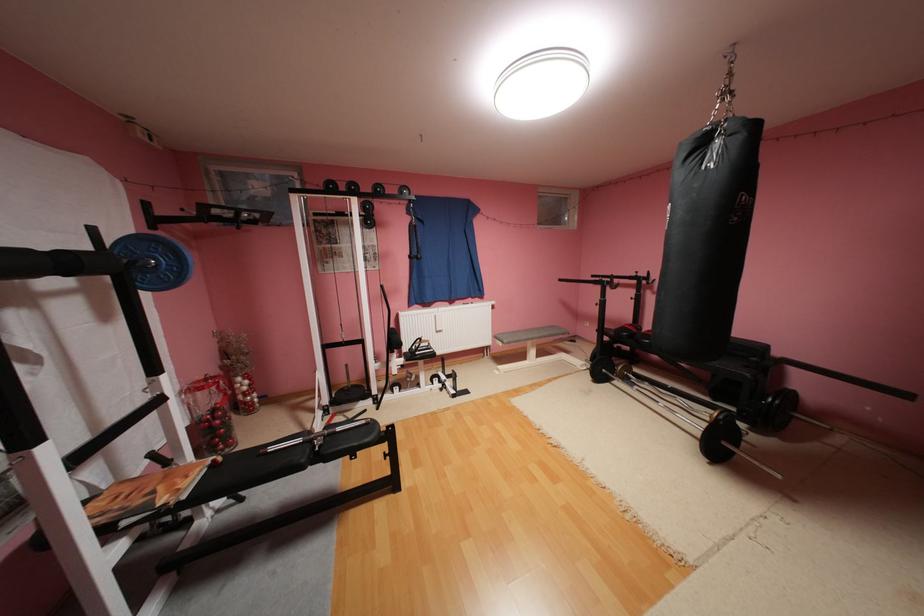
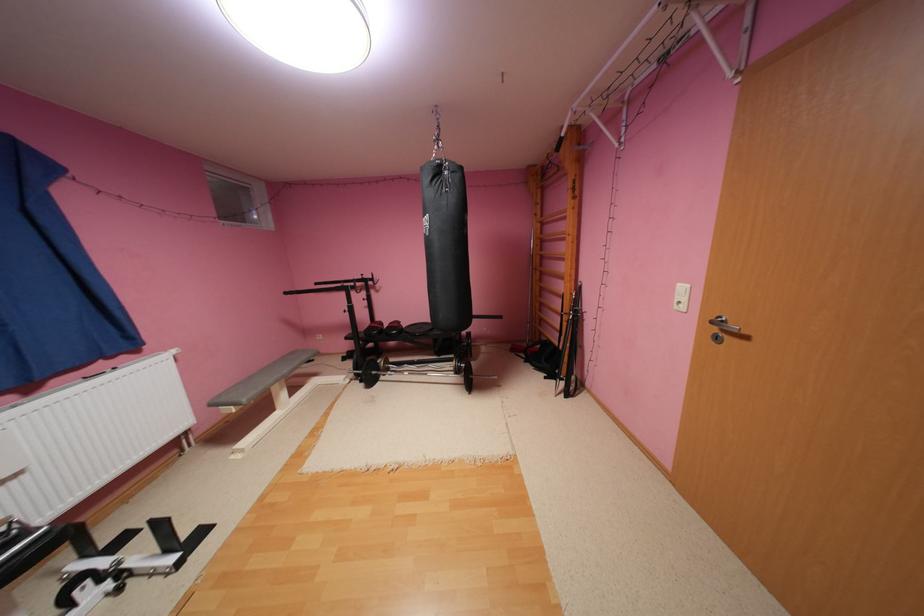
The point at (507,336) is marked in the first image. Where is the corresponding point in the second image?

(233, 399)